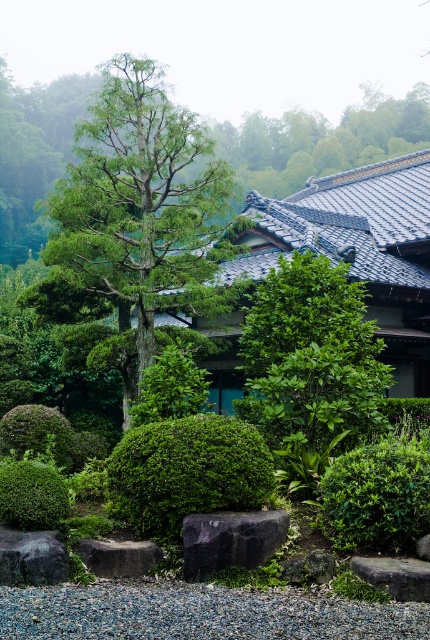
Is the position of green leafy bush at lower right more distant than that of green mossy bush at lower left?

No.

Between point (409, 470) and point (36, 502), which one is positioned behind?

The point (36, 502) is behind.

Image resolution: width=430 pixels, height=640 pixels. What are the coordinates of `green leafy bush at lower right` in the screenshot? It's located at (377, 493).

How distant is green textured tree at center from black smooth rock at lower left?

20.08 feet

The height and width of the screenshot is (640, 430). Describe the element at coordinates (143, 208) in the screenshot. I see `green textured tree at center` at that location.

You are a GUI agent. You are given a task and a screenshot of the screen. Output one action in this format:
    pyautogui.click(x=<x>, y=<y>)
    Task: Click on the green textured tree at center
    This screenshot has height=640, width=430.
    Given the screenshot: What is the action you would take?
    point(143,208)

In the scene shown: Can you confirm if gray gravel at lower center is positioned to the right of green mossy bush at center?

Indeed, gray gravel at lower center is positioned on the right side of green mossy bush at center.

Who is more forward, (64, 600) or (212, 456)?

Point (64, 600) is in front.

Is point (27, 627) in front of point (181, 452)?

That is True.

The width and height of the screenshot is (430, 640). What are the coordinates of `gray gravel at lower center` in the screenshot? It's located at (199, 612).